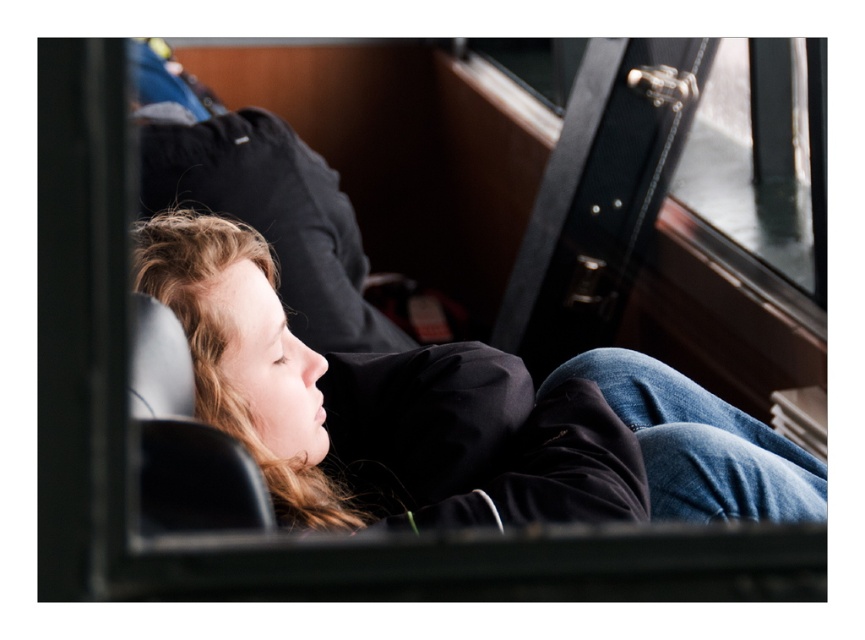
Question: From the image, what is the correct spatial relationship of matte black jacket at center in relation to black leather window at upper right?

Choices:
 (A) left
 (B) right

Answer: (A)

Question: Does black leather chair at left appear under black leather window at upper right?

Choices:
 (A) no
 (B) yes

Answer: (B)

Question: Which object is closer to the camera taking this photo?

Choices:
 (A) matte black jacket at center
 (B) black leather chair at left
 (C) black leather window at upper right

Answer: (B)

Question: Among these points, which one is nearest to the camera?

Choices:
 (A) (231, 515)
 (B) (222, 314)
 (C) (729, 244)

Answer: (A)

Question: Does matte black jacket at center lie behind black leather chair at left?

Choices:
 (A) yes
 (B) no

Answer: (A)

Question: Which object is farther from the camera taking this photo?

Choices:
 (A) matte black jacket at center
 (B) black leather chair at left
 (C) black leather window at upper right

Answer: (C)